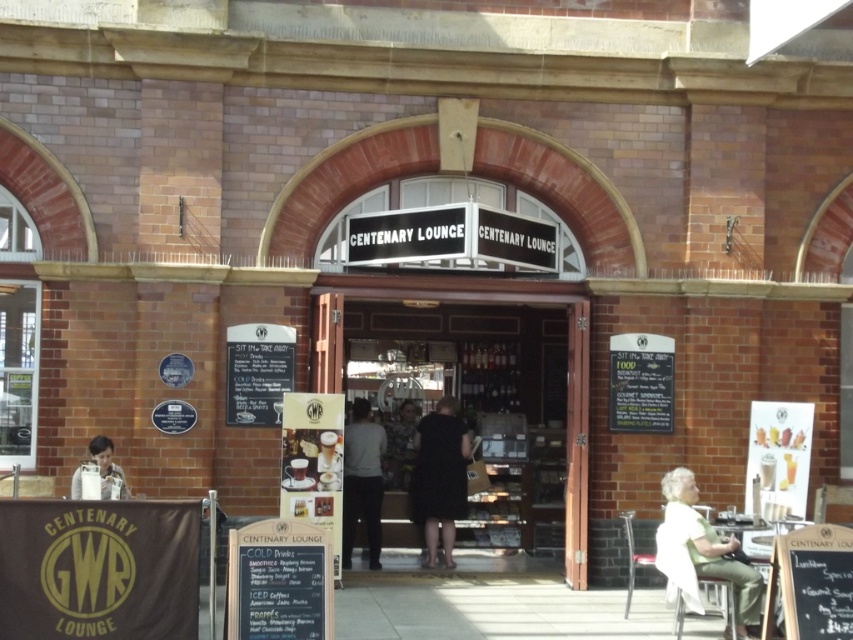
Looking at this image, you are standing at the entrance of the CENTENARY LOUNGE building. There is a black dress at center located at point (439, 477). If you walk straight towards the entrance, will you pass by the black dress at center before reaching the entrance?

The black dress at center is located at point (439, 477), which is in front of the entrance. Therefore, walking straight towards the entrance, you will pass by the black dress at center before reaching the entrance.